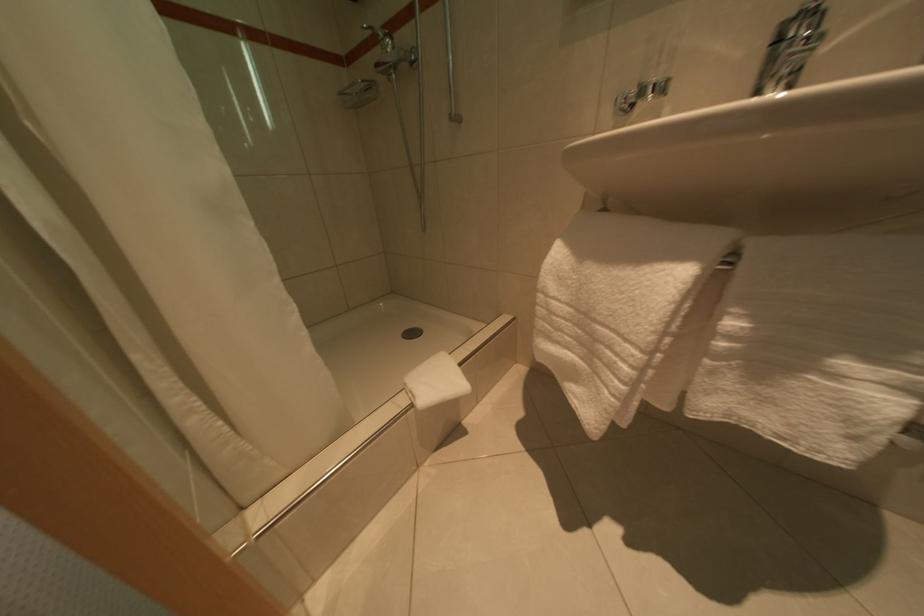
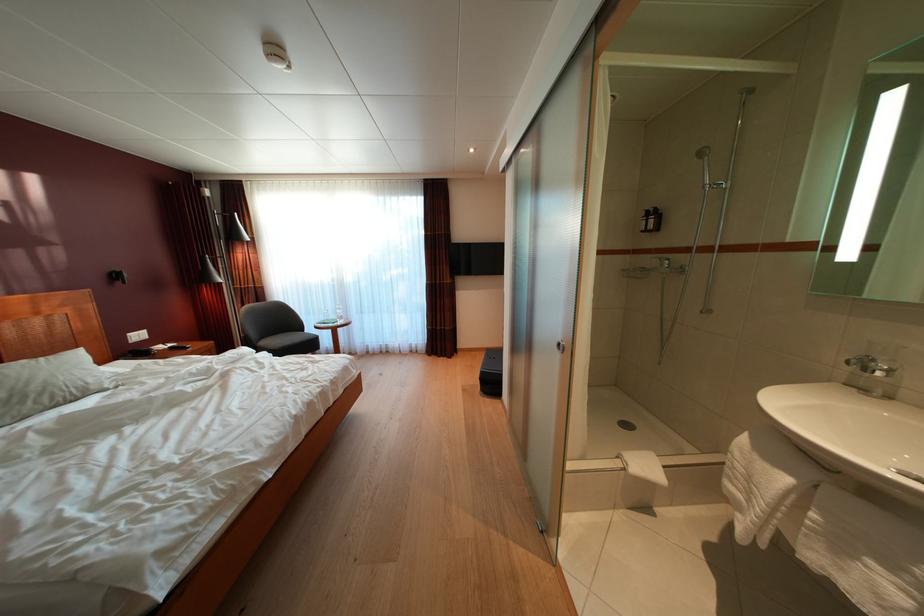
Locate, in the second image, the point that corresponds to (x=649, y=100) in the first image.

(871, 376)